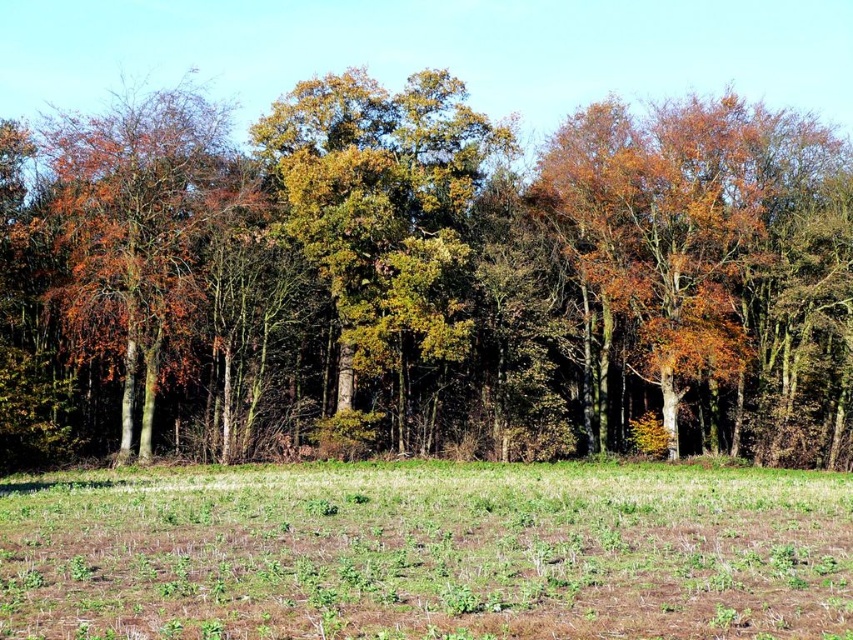
In the scene shown: Does green leafy trees at center have a greater width compared to green grass at lower center?

Yes, green leafy trees at center is wider than green grass at lower center.

Is green leafy trees at center smaller than green grass at lower center?

No.

This screenshot has height=640, width=853. Find the location of `green leafy trees at center`. green leafy trees at center is located at coordinates (426, 278).

Between point (412, 529) and point (181, 296), which one is positioned in front?

Point (412, 529) is in front.

Does point (51, 522) come in front of point (128, 104)?

That is True.

Does point (32, 544) come closer to viewer compared to point (222, 122)?

Yes, it is.

At what (x,y) coordinates should I click in order to perform the action: click on green grass at lower center. Please return your answer as a coordinate pair (x, y). Looking at the image, I should click on (426, 552).

The image size is (853, 640). What do you see at coordinates (383, 211) in the screenshot?
I see `green leafy tree at center` at bounding box center [383, 211].

Does green leafy tree at center come behind orange-brown bark tree at left?

That is True.

Is point (381, 284) positioned after point (248, 205)?

Yes, it is behind point (248, 205).

Locate an element on the screen. green leafy tree at center is located at coordinates (383, 211).